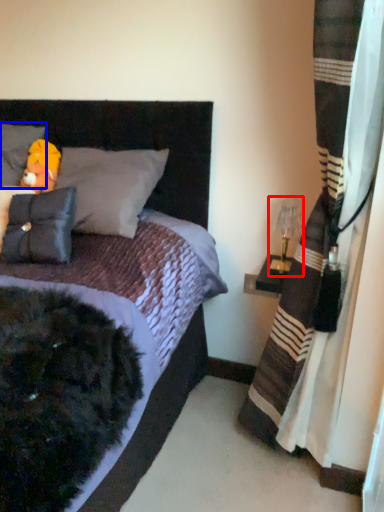
Question: Among these objects, which one is farthest to the camera, table lamp (highlighted by a red box) or pillow (highlighted by a blue box)?

Choices:
 (A) table lamp
 (B) pillow

Answer: (B)